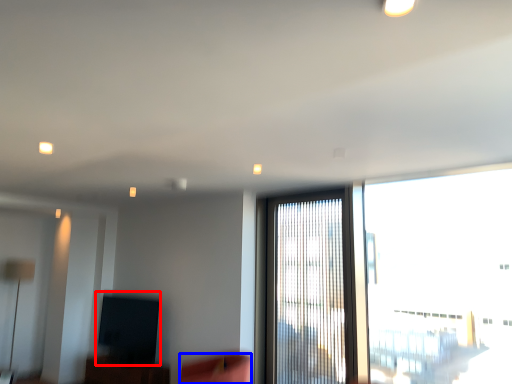
Question: Among these objects, which one is nearest to the camera, window screen (highlighted by a red box) or swivel chair (highlighted by a blue box)?

Choices:
 (A) window screen
 (B) swivel chair

Answer: (B)